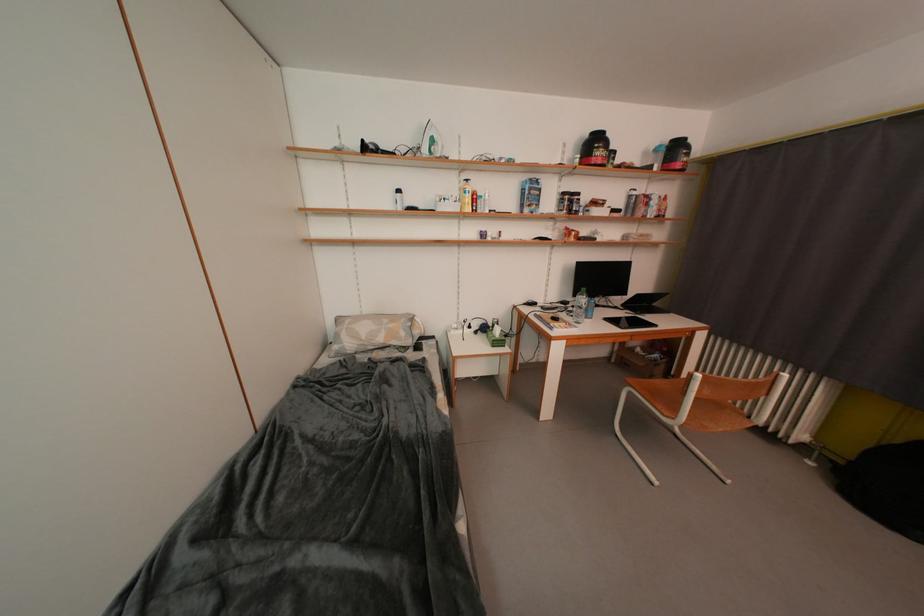
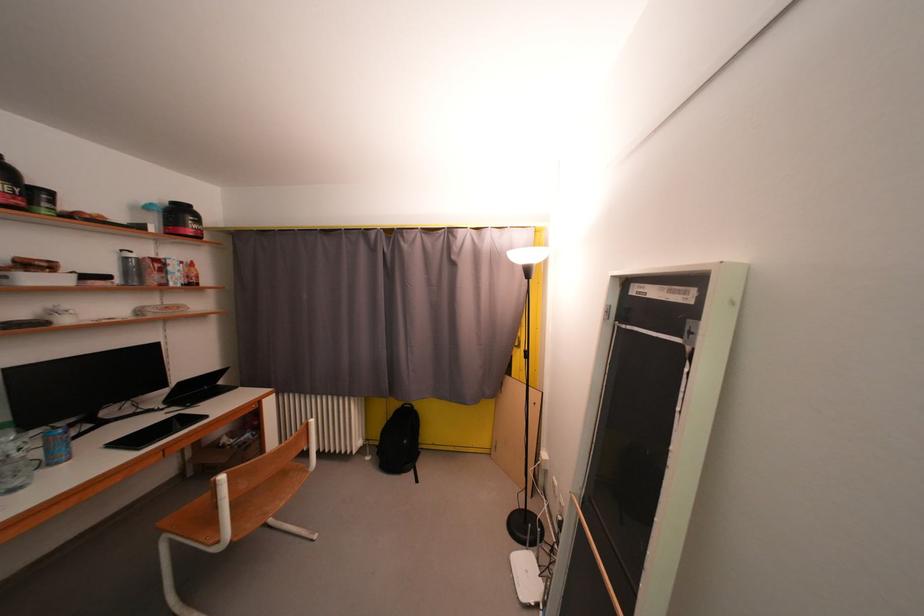
Locate, in the second image, the point that corresponds to (x=840, y=464) in the first image.

(384, 450)